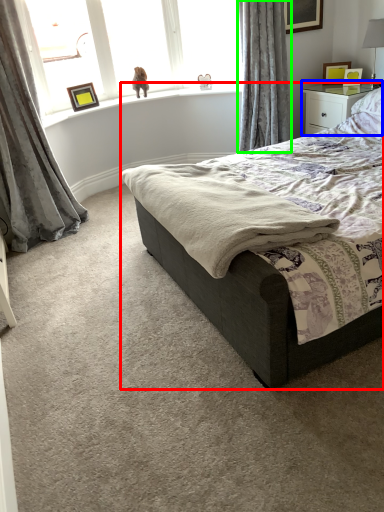
Question: Which object is the farthest from bed (highlighted by a red box)? Choose among these: nightstand (highlighted by a blue box) or curtain (highlighted by a green box).

Choices:
 (A) nightstand
 (B) curtain

Answer: (B)